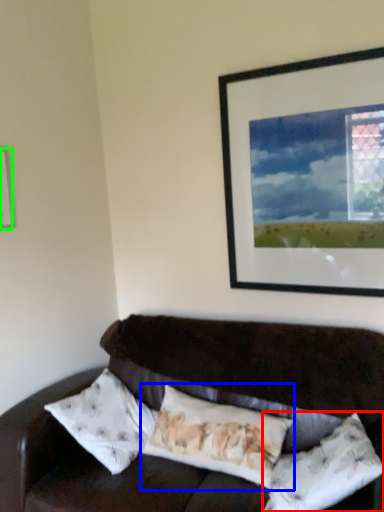
Question: Considering the real-world distances, which object is closest to pillow (highlighted by a red box)? pillow (highlighted by a blue box) or picture frame (highlighted by a green box).

Choices:
 (A) pillow
 (B) picture frame

Answer: (A)